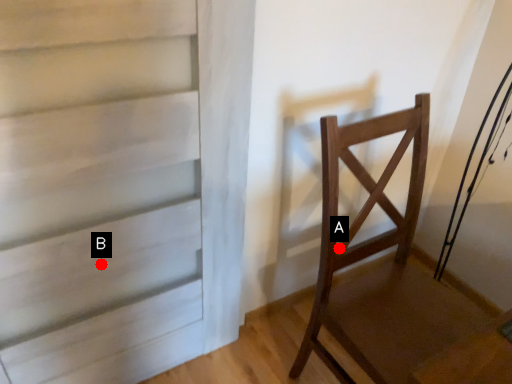
Question: Two points are circled on the image, labeled by A and B beside each circle. Which point appears closest to the camera in this image?

Choices:
 (A) A is closer
 (B) B is closer

Answer: (B)